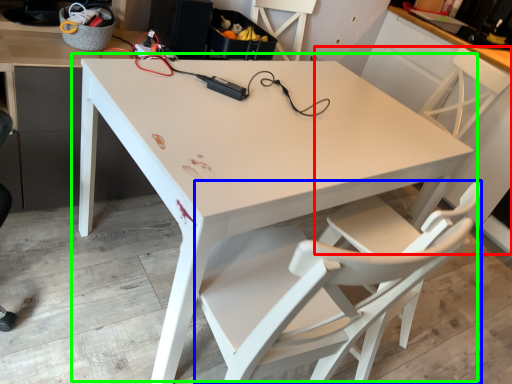
Question: Considering the real-world distances, which object is closest to chair (highlighted by a red box)? chair (highlighted by a blue box) or table (highlighted by a green box).

Choices:
 (A) chair
 (B) table

Answer: (B)